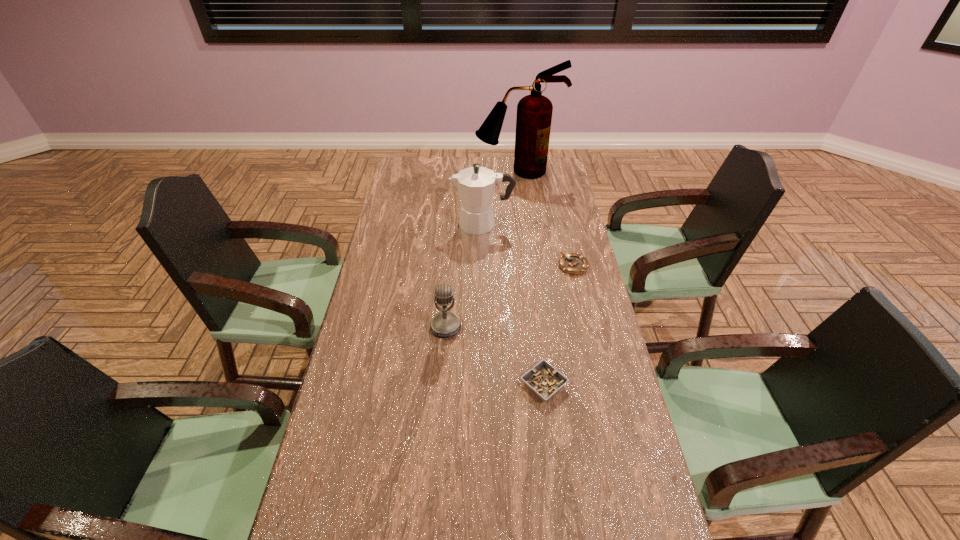
This screenshot has height=540, width=960. In order to click on free space located at the nozzle of the tallest object in this screenshot , I will do `click(524, 226)`.

The width and height of the screenshot is (960, 540). Find the location of `free region located 0.120m at the spout of the fourth nearest object`. free region located 0.120m at the spout of the fourth nearest object is located at coordinates (422, 224).

Find the location of a particular element. Image resolution: width=960 pixels, height=540 pixels. vacant space located at the spout of the fourth nearest object is located at coordinates (427, 224).

This screenshot has width=960, height=540. I want to click on vacant space located 0.180m at the spout of the fourth nearest object, so click(x=408, y=224).

Locate an element on the screen. The height and width of the screenshot is (540, 960). vacant space located 0.050m on the front-facing side of the microphone is located at coordinates (444, 353).

Locate an element on the screen. The height and width of the screenshot is (540, 960). free space located on the left of the farther ashtray is located at coordinates (457, 266).

This screenshot has width=960, height=540. I want to click on free space located 0.320m on the left of the nearer ashtray, so click(409, 384).

I want to click on object positioned at the far edge, so click(x=534, y=112).

Locate an element on the screen. The height and width of the screenshot is (540, 960). fire extinguisher situated at the right edge is located at coordinates (534, 112).

The image size is (960, 540). In order to click on object located in the far right corner section of the desktop in this screenshot , I will do `click(534, 112)`.